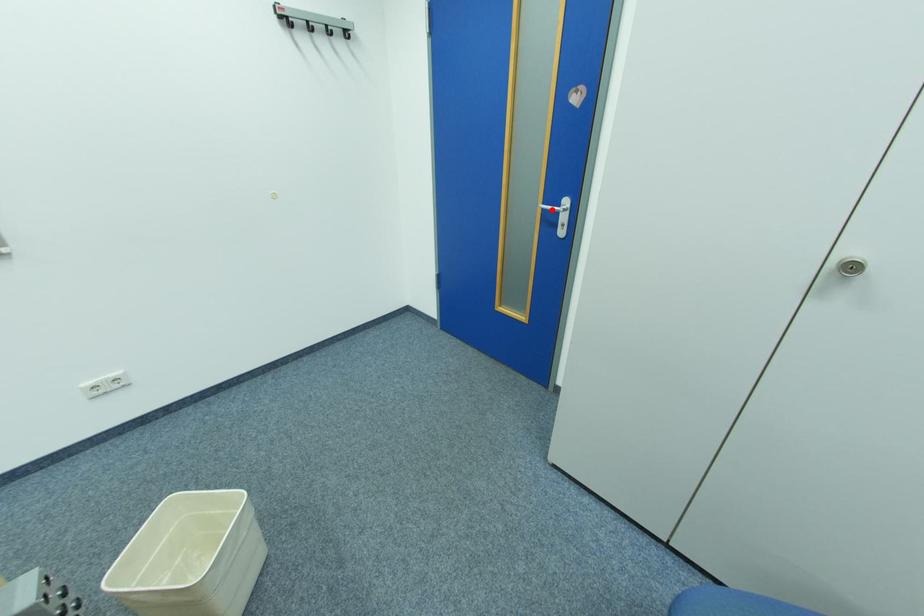
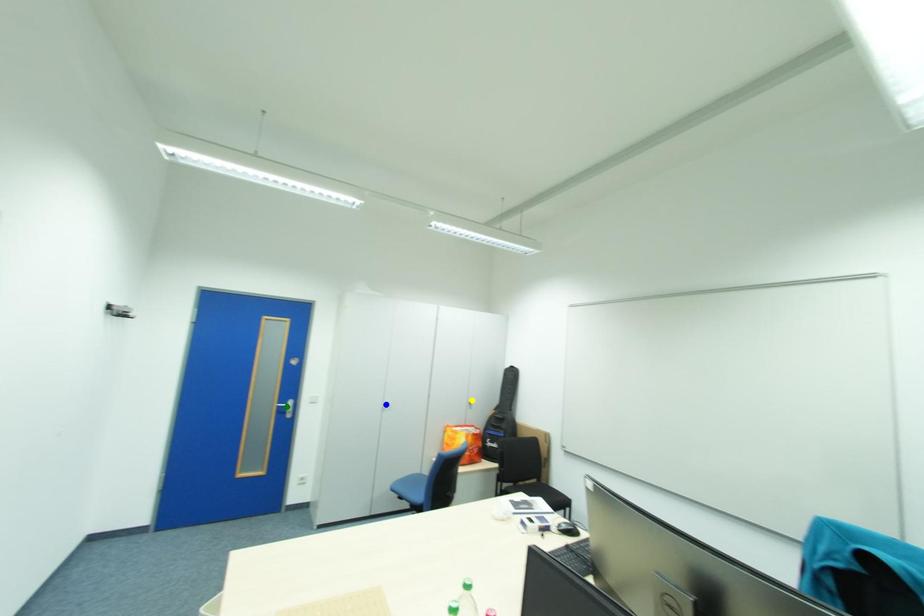
Question: I am providing you with two images of the same scene from different viewpoints. A red point is marked on the first image. You are given multiple points on the second image. Which point in image 2 represents the same 3d spot as the red point in image 1?

Choices:
 (A) green point
 (B) yellow point
 (C) blue point

Answer: (A)